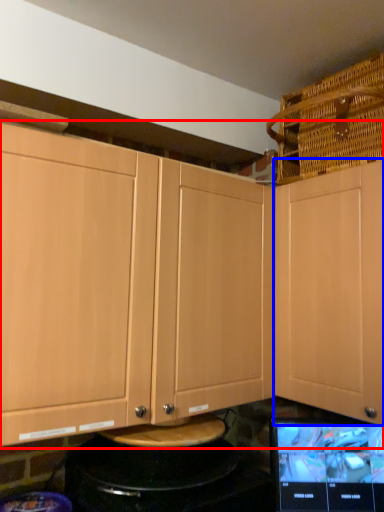
Question: Among these objects, which one is farthest to the camera, cabinetry (highlighted by a red box) or cabinetry (highlighted by a blue box)?

Choices:
 (A) cabinetry
 (B) cabinetry

Answer: (B)